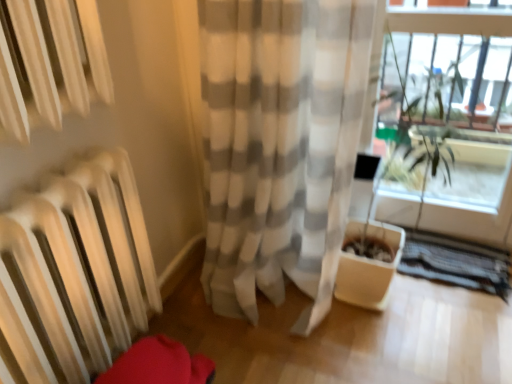
Where is `white sheer curtain at center`? This screenshot has width=512, height=384. white sheer curtain at center is located at coordinates point(280,145).

What do you see at coordinates (280, 145) in the screenshot? I see `white sheer curtain at center` at bounding box center [280, 145].

What do you see at coordinates (449, 100) in the screenshot? The height and width of the screenshot is (384, 512). I see `clear glass window frame at upper right` at bounding box center [449, 100].

The image size is (512, 384). What are the coordinates of `clear glass window frame at upper right` in the screenshot? It's located at (449, 100).

Locate an element on the screen. Image resolution: width=512 pixels, height=384 pixels. white sheer curtain at center is located at coordinates (280, 145).

Is white sheer curtain at center to the right of clear glass window frame at upper right from the viewer's perspective?

In fact, white sheer curtain at center is to the left of clear glass window frame at upper right.

Relative to clear glass window frame at upper right, is white sheer curtain at center in front or behind?

Clearly, white sheer curtain at center is in front of clear glass window frame at upper right.

Does point (220, 267) lie in front of point (428, 127)?

That is False.

From the image's perspective, relative to clear glass window frame at upper right, is white sheer curtain at center above or below?

Based on their image positions, white sheer curtain at center is located beneath clear glass window frame at upper right.

From a real-world perspective, is white sheer curtain at center on top of clear glass window frame at upper right?

Yes, from a real-world perspective, white sheer curtain at center is above clear glass window frame at upper right.

Considering the relative sizes of white sheer curtain at center and clear glass window frame at upper right in the image provided, is white sheer curtain at center thinner than clear glass window frame at upper right?

Incorrect, the width of white sheer curtain at center is not less than that of clear glass window frame at upper right.

Is white sheer curtain at center taller than clear glass window frame at upper right?

Yes.

Can you confirm if white sheer curtain at center is bigger than clear glass window frame at upper right?

Indeed, white sheer curtain at center has a larger size compared to clear glass window frame at upper right.

Would you say clear glass window frame at upper right is part of white sheer curtain at center's contents?

Actually, clear glass window frame at upper right is outside white sheer curtain at center.

In the scene shown: Is white sheer curtain at center directly adjacent to clear glass window frame at upper right?

No, white sheer curtain at center is not with clear glass window frame at upper right.

Could you tell me if white sheer curtain at center is facing clear glass window frame at upper right?

No, white sheer curtain at center is not facing towards clear glass window frame at upper right.

How different are the orientations of white sheer curtain at center and clear glass window frame at upper right in degrees?

0.201 degrees.

Find the location of a particular element. curtain on the left side of clear glass window frame at upper right is located at coordinates (280, 145).

In the image, is clear glass window frame at upper right on the left side or the right side of white sheer curtain at center?

clear glass window frame at upper right is positioned on white sheer curtain at center's right side.

In the image, is clear glass window frame at upper right positioned in front of or behind white sheer curtain at center?

clear glass window frame at upper right is positioned farther from the viewer than white sheer curtain at center.

Between point (388, 190) and point (356, 124), which one is positioned behind?

The point (388, 190) is more distant.

From the image's perspective, which one is positioned lower, clear glass window frame at upper right or white sheer curtain at center?

white sheer curtain at center, from the image's perspective.

From a real-world perspective, is clear glass window frame at upper right below white sheer curtain at center?

A: Yes, from a real-world perspective, clear glass window frame at upper right is under white sheer curtain at center.

Is clear glass window frame at upper right wider than white sheer curtain at center?

No.

Between clear glass window frame at upper right and white sheer curtain at center, which one has less height?

Standing shorter between the two is clear glass window frame at upper right.

In the scene shown: Is clear glass window frame at upper right bigger or smaller than white sheer curtain at center?

Considering their sizes, clear glass window frame at upper right takes up less space than white sheer curtain at center.

Is clear glass window frame at upper right located outside white sheer curtain at center?

Absolutely, clear glass window frame at upper right is external to white sheer curtain at center.

Is there a large distance between clear glass window frame at upper right and white sheer curtain at center?

clear glass window frame at upper right is near white sheer curtain at center, not far away.

Consider the image. Is white sheer curtain at center at the back of clear glass window frame at upper right?

clear glass window frame at upper right does not have its back to white sheer curtain at center.

In the scene shown: How many degrees apart are the facing directions of clear glass window frame at upper right and white sheer curtain at center?

They differ by 0.201 degrees in their facing directions.

How far apart are clear glass window frame at upper right and white sheer curtain at center?

A distance of 21.90 inches exists between clear glass window frame at upper right and white sheer curtain at center.

Locate an element on the screen. curtain in front of the clear glass window frame at upper right is located at coordinates 280,145.

Locate an element on the screen. window frame beneath the white sheer curtain at center (from a real-world perspective) is located at coordinates (449, 100).

I want to click on curtain that appears below the clear glass window frame at upper right (from the image's perspective), so click(280, 145).